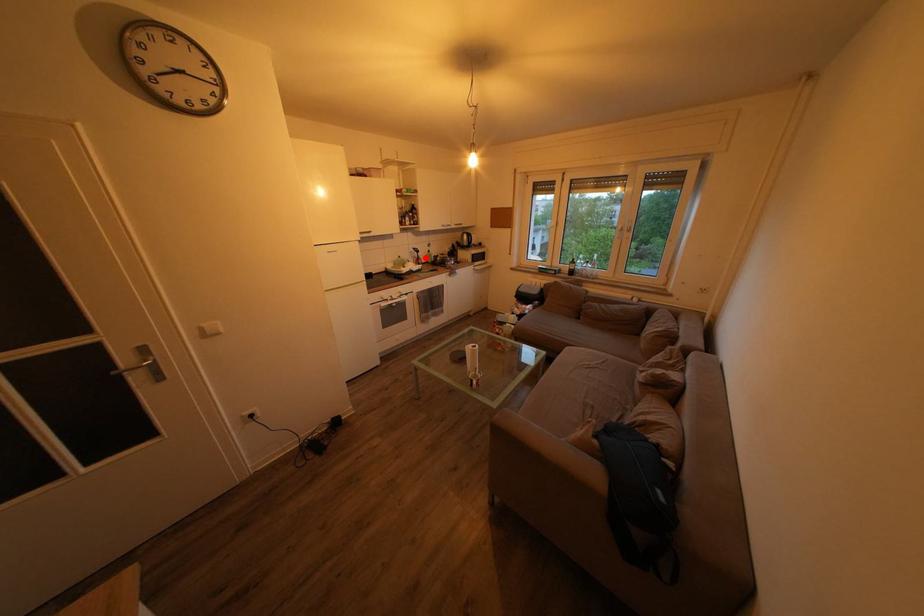
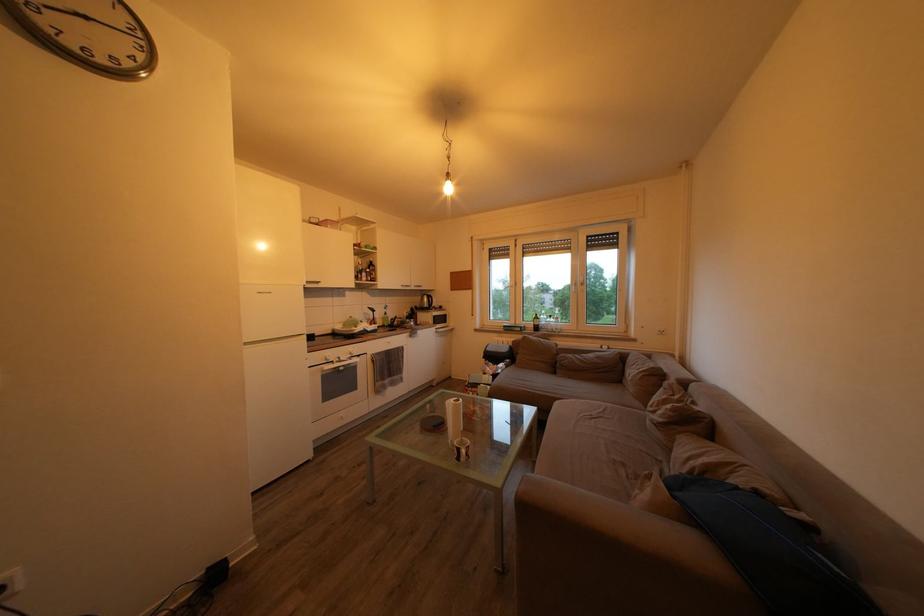
Where in the second image is the point corresponding to the highlighted location from the first image?

(381, 317)